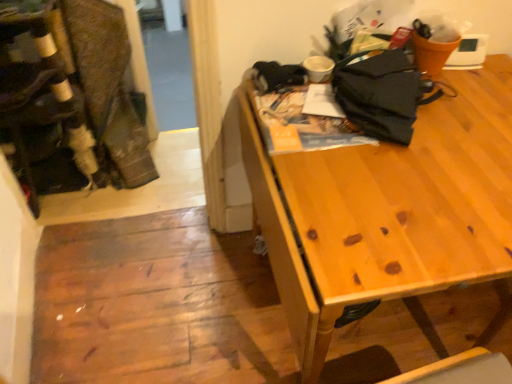
In order to click on brown textured fabric laundry at left in this screenshot , I will do `click(109, 90)`.

Locate an element on the screen. This screenshot has width=512, height=384. black fabric umbrella at upper right is located at coordinates (382, 95).

What is the approximate width of wooden table at upper right?

31.12 inches.

This screenshot has width=512, height=384. I want to click on brown textured fabric laundry at left, so click(x=109, y=90).

Can you confirm if brown textured fabric laundry at left is positioned to the left of wooden table at upper right?

Yes.

What's the angular difference between brown textured fabric laundry at left and wooden table at upper right's facing directions?

The angular difference between brown textured fabric laundry at left and wooden table at upper right is 1 degrees.

I want to click on desk that appears on the right of brown textured fabric laundry at left, so click(387, 209).

Is brown textured fabric laundry at left far away from wooden table at upper right?

That's right, there is a large distance between brown textured fabric laundry at left and wooden table at upper right.

Find the location of a particular element. This screenshot has height=384, width=512. laundry on the right of velvet-like fabric at left is located at coordinates (109, 90).

Is brown textured fabric laundry at left surrounding velvet-like fabric at left?

Definitely not — velvet-like fabric at left is not inside brown textured fabric laundry at left.

Is brown textured fabric laundry at left far away from velvet-like fabric at left?

No.

From a real-world perspective, does brown textured fabric laundry at left sit lower than black fabric umbrella at upper right?

Yes, from a real-world perspective, brown textured fabric laundry at left is beneath black fabric umbrella at upper right.

Is brown textured fabric laundry at left placed right next to black fabric umbrella at upper right?

No, brown textured fabric laundry at left is not making contact with black fabric umbrella at upper right.

Which of these two, brown textured fabric laundry at left or black fabric umbrella at upper right, is wider?

With larger width is brown textured fabric laundry at left.

Could you tell me if brown textured fabric laundry at left is turned towards black fabric umbrella at upper right?

No, brown textured fabric laundry at left is not facing towards black fabric umbrella at upper right.

From a real-world perspective, which object rests below the other?

brown textured fabric laundry at left is physically lower.

The width and height of the screenshot is (512, 384). What are the coordinates of `desk above the brown textured fabric laundry at left (from a real-world perspective)` in the screenshot? It's located at (387, 209).

Which of these two, wooden table at upper right or brown textured fabric laundry at left, is bigger?

wooden table at upper right is bigger.

Are wooden table at upper right and brown textured fabric laundry at left located far from each other?

wooden table at upper right is far away from brown textured fabric laundry at left.

Does velvet-like fabric at left have a greater width compared to wooden table at upper right?

No, velvet-like fabric at left is not wider than wooden table at upper right.

From the image's perspective, does velvet-like fabric at left appear lower than wooden table at upper right?

No.

Considering the sizes of objects velvet-like fabric at left and wooden table at upper right in the image provided, who is shorter, velvet-like fabric at left or wooden table at upper right?

With less height is wooden table at upper right.

In the scene shown: Who is more distant, velvet-like fabric at left or wooden table at upper right?

velvet-like fabric at left.

You are a GUI agent. You are given a task and a screenshot of the screen. Output one action in this format:
    pyautogui.click(x=<x>, y=<y>)
    Task: Click on the clothing on the right of velvet-like fabric at left
    This screenshot has width=512, height=384.
    Given the screenshot: What is the action you would take?
    pyautogui.click(x=382, y=95)

From a real-world perspective, is velvet-like fabric at left located beneath black fabric umbrella at upper right?

Indeed, from a real-world perspective, velvet-like fabric at left is positioned beneath black fabric umbrella at upper right.

From the image's perspective, would you say velvet-like fabric at left is positioned over black fabric umbrella at upper right?

Yes, from the image's perspective, velvet-like fabric at left is on top of black fabric umbrella at upper right.

How much distance is there between velvet-like fabric at left and black fabric umbrella at upper right?

velvet-like fabric at left and black fabric umbrella at upper right are 1.70 meters apart.

Based on the photo, from the image's perspective, does black fabric umbrella at upper right appear lower than wooden table at upper right?

Actually, black fabric umbrella at upper right appears above wooden table at upper right in the image.

Is black fabric umbrella at upper right thinner than wooden table at upper right?

Yes.

Identify the location of desk located below the black fabric umbrella at upper right (from the image's perspective). The height and width of the screenshot is (384, 512). (387, 209).

Would you say black fabric umbrella at upper right is to the left or to the right of wooden table at upper right in the picture?

Based on their positions, black fabric umbrella at upper right is located to the left of wooden table at upper right.

This screenshot has height=384, width=512. I want to click on laundry that appears behind the wooden table at upper right, so click(x=109, y=90).

Where is `laundry above the velvet-like fabric at left (from the image's perspective)`? laundry above the velvet-like fabric at left (from the image's perspective) is located at coordinates (109, 90).

Looking at the image, which one is located closer to wooden table at upper right, black fabric umbrella at upper right or velvet-like fabric at left?

black fabric umbrella at upper right.

From the picture: Based on their spatial positions, is velvet-like fabric at left or wooden table at upper right closer to brown textured fabric laundry at left?

The object closer to brown textured fabric laundry at left is velvet-like fabric at left.

Considering their positions, is velvet-like fabric at left positioned closer to black fabric umbrella at upper right than wooden table at upper right?

Among the two, wooden table at upper right is located nearer to black fabric umbrella at upper right.

Which object lies further to the anchor point brown textured fabric laundry at left, black fabric umbrella at upper right or velvet-like fabric at left?

black fabric umbrella at upper right.

Based on their spatial positions, is brown textured fabric laundry at left or velvet-like fabric at left closer to wooden table at upper right?

velvet-like fabric at left is positioned closer to the anchor wooden table at upper right.

Considering their positions, is brown textured fabric laundry at left positioned further to wooden table at upper right than black fabric umbrella at upper right?

brown textured fabric laundry at left is further to wooden table at upper right.

Consider the image. Estimate the real-world distances between objects in this image. Which object is closer to velvet-like fabric at left, wooden table at upper right or black fabric umbrella at upper right?

wooden table at upper right is positioned closer to the anchor velvet-like fabric at left.

Looking at the image, which one is located further to velvet-like fabric at left, wooden table at upper right or brown textured fabric laundry at left?

wooden table at upper right lies further to velvet-like fabric at left than the other object.

Identify the location of laundry between velvet-like fabric at left and black fabric umbrella at upper right in the horizontal direction. The width and height of the screenshot is (512, 384). (109, 90).

In order to click on clothing between velvet-like fabric at left and wooden table at upper right in the horizontal direction in this screenshot , I will do `click(382, 95)`.

This screenshot has height=384, width=512. What are the coordinates of `clothing between brown textured fabric laundry at left and wooden table at upper right in the horizontal direction` in the screenshot? It's located at (382, 95).

Locate an element on the screen. laundry situated between velvet-like fabric at left and wooden table at upper right from left to right is located at coordinates pos(109,90).